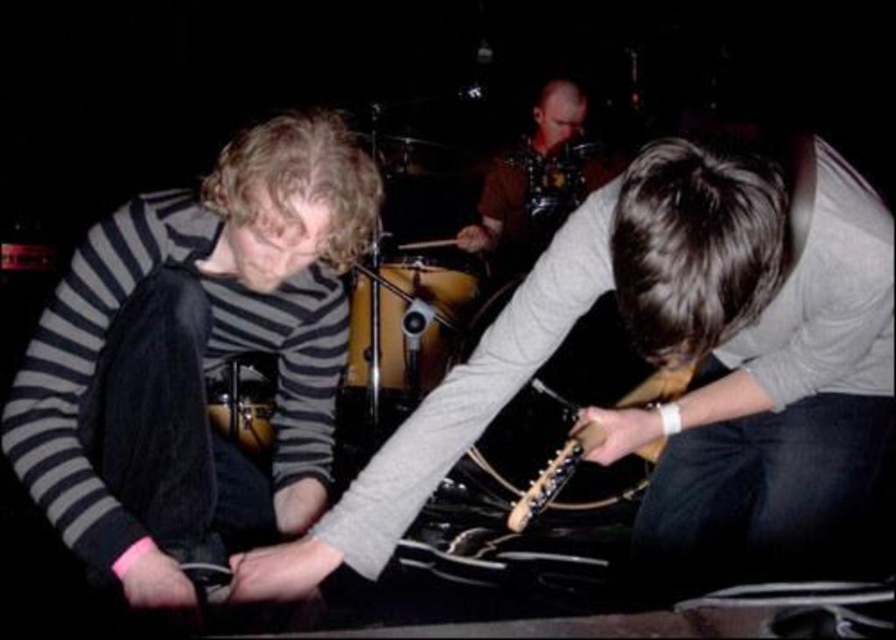
Question: Which object is the closest to the brown leather jacket at center?

Choices:
 (A) wooden electric guitar at center
 (B) striped fabric shirt at left
 (C) wooden electric guitar at lower center

Answer: (C)

Question: Among these points, which one is nearest to the camera?

Choices:
 (A) (113, 237)
 (B) (411, 262)

Answer: (A)

Question: Does wooden electric guitar at center have a larger size compared to brown leather jacket at center?

Choices:
 (A) no
 (B) yes

Answer: (B)

Question: Can you confirm if yellow drum set at center is positioned below wooden electric guitar at lower center?

Choices:
 (A) yes
 (B) no

Answer: (B)

Question: Among these points, which one is farthest from the camera?

Choices:
 (A) (721, 492)
 (B) (575, 154)
 (C) (685, 381)

Answer: (B)

Question: Is the position of striped fabric shirt at left less distant than that of yellow drum set at center?

Choices:
 (A) no
 (B) yes

Answer: (B)